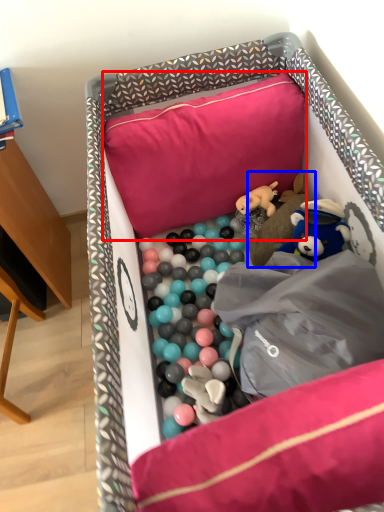
Question: Which object is closer to the camera taking this photo, pillow (highlighted by a red box) or toy (highlighted by a blue box)?

Choices:
 (A) pillow
 (B) toy

Answer: (A)